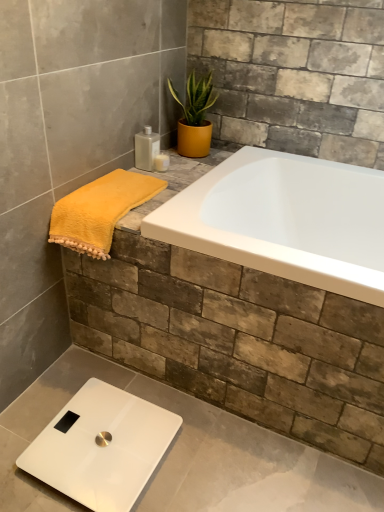
The height and width of the screenshot is (512, 384). I want to click on blank space above yellow fluffy towel at left (from a real-world perspective), so click(107, 189).